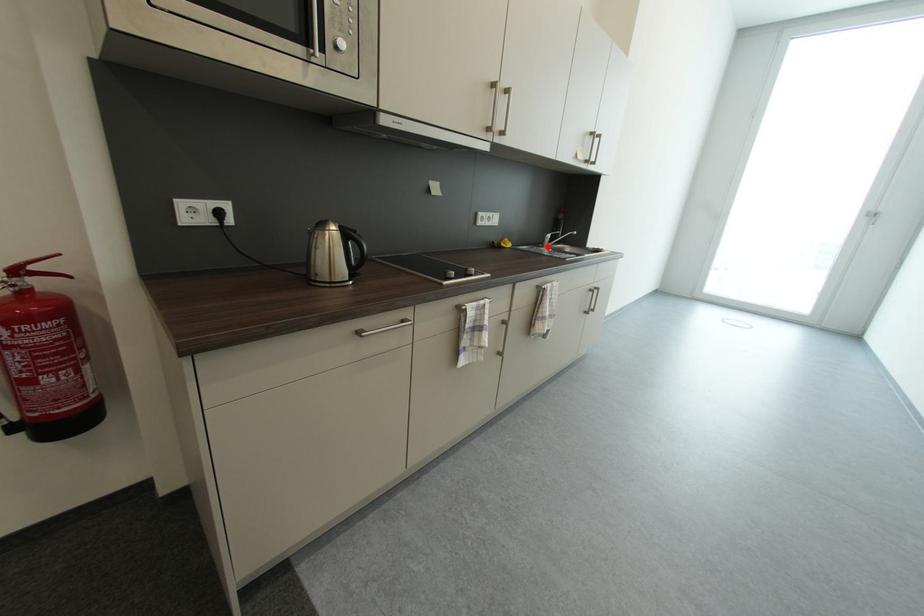
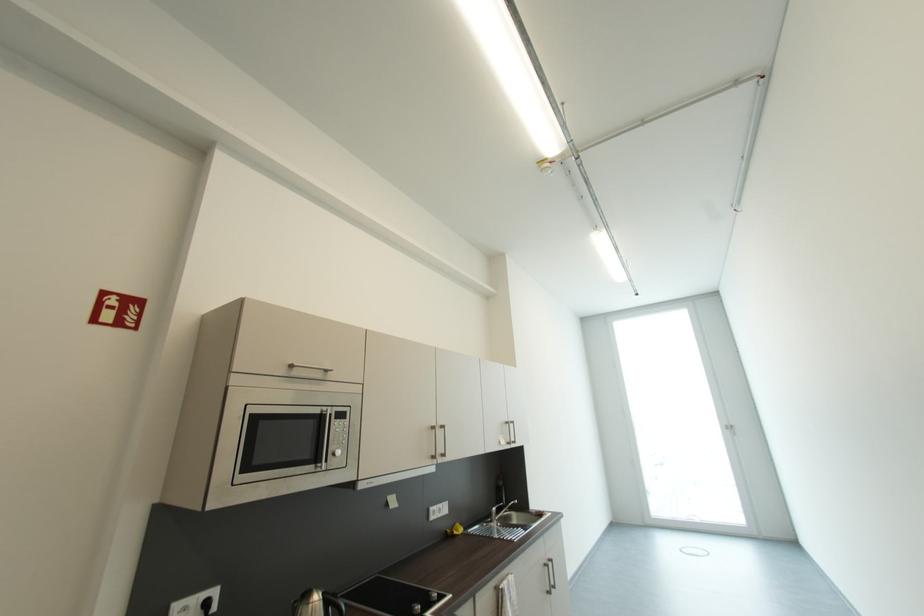
Question: I am providing you with two images of the same scene from different viewpoints. In image1, a red point is highlighted. Considering the same 3D point in image2, which of the following is correct?

Choices:
 (A) It is closer
 (B) It is farther

Answer: (B)